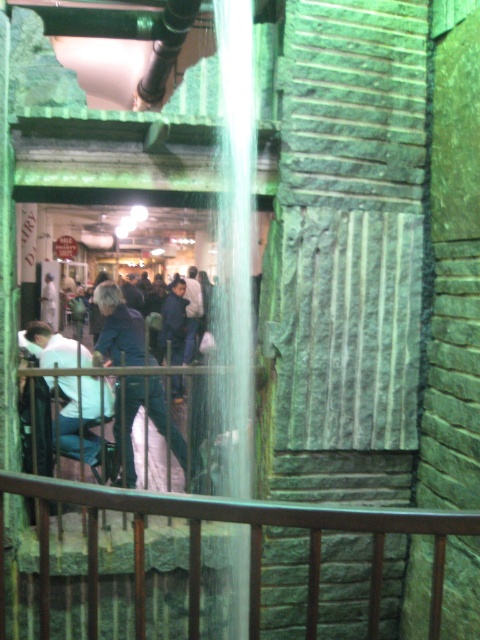
Between point (97, 294) and point (98, 401), which one is positioned behind?

Positioned behind is point (98, 401).

At what (x,y) coordinates should I click in order to perform the action: click on denim jacket at center. Please return your answer as a coordinate pair (x, y). This screenshot has height=640, width=480. Looking at the image, I should click on point(149,417).

The width and height of the screenshot is (480, 640). I want to click on denim jacket at center, so point(149,417).

I want to click on brown wooden rail at center, so click(x=247, y=544).

Is point (409, 513) in front of point (118, 429)?

Yes, point (409, 513) is closer to viewer.

The width and height of the screenshot is (480, 640). Find the location of `brown wooden rail at center`. brown wooden rail at center is located at coordinates (247, 544).

This screenshot has height=640, width=480. What are the coordinates of `brown wooden rail at center` in the screenshot? It's located at (247, 544).

Does point (120, 310) lie in front of point (116, 300)?

No, (120, 310) is behind (116, 300).

Does matte white shirt at center lie in front of denim jacket at center?

Yes, it is.

Does point (180, 444) come in front of point (151, 392)?

No, it is behind (151, 392).

This screenshot has height=640, width=480. In order to click on matte white shirt at center in this screenshot , I will do `click(132, 380)`.